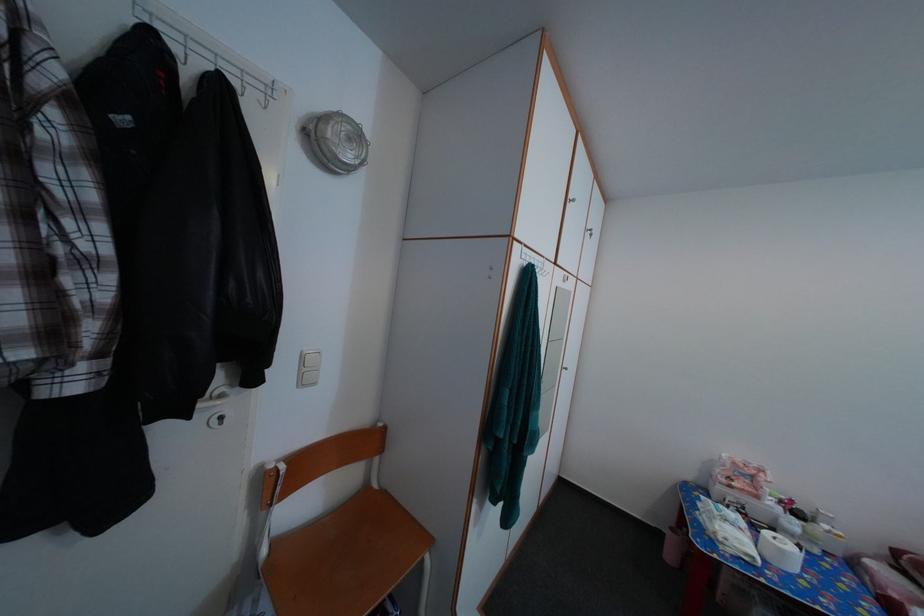
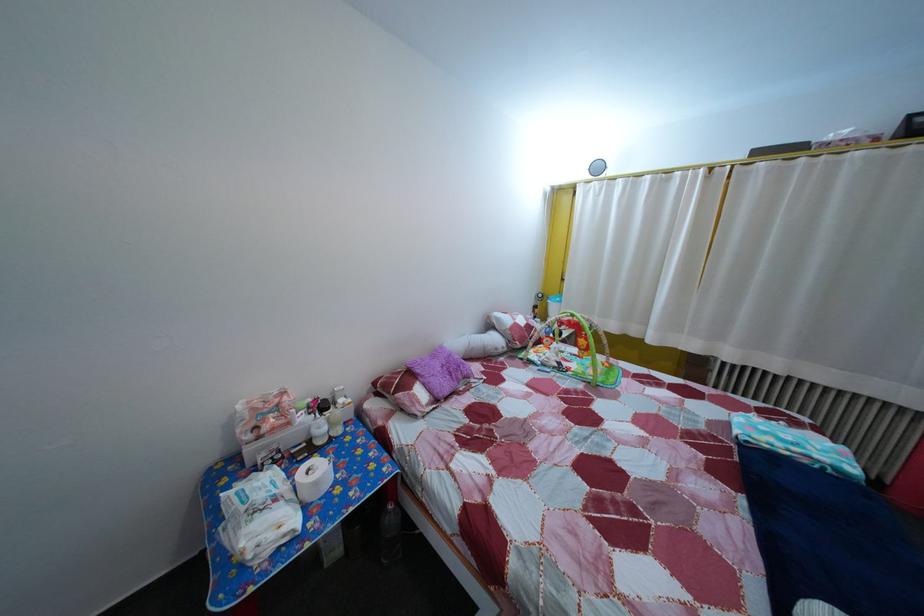
The point at [782,511] is marked in the first image. Where is the corresponding point in the second image?

(311, 427)